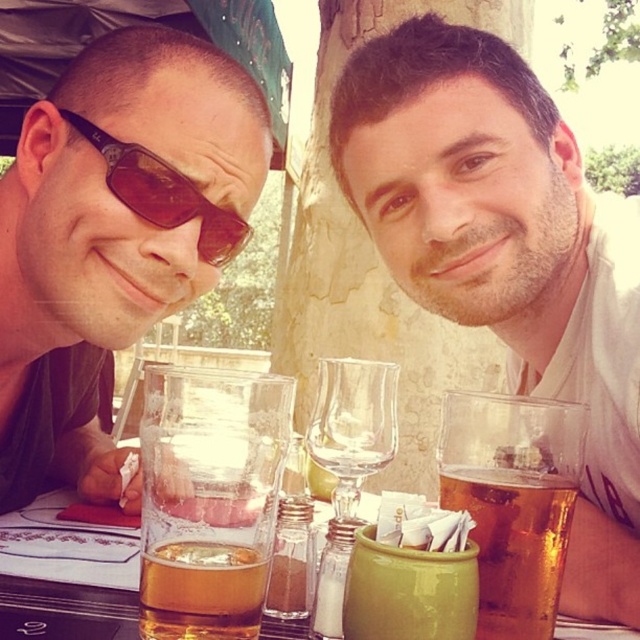
Question: Is smooth white shirt at upper right positioned at the back of translucent glass mug at center?

Choices:
 (A) yes
 (B) no

Answer: (A)

Question: Which point appears closest to the camera in this image?

Choices:
 (A) (140, 605)
 (B) (458, 90)
 (C) (259, 556)

Answer: (A)

Question: Which of the following is the farthest from the observer?

Choices:
 (A) smooth white shirt at upper right
 (B) translucent glass beer at center
 (C) brown reflective sunglasses at left
 (D) amber glass at center

Answer: (C)

Question: Is translucent glass beer at center positioned in front of translucent glass mug at center?

Choices:
 (A) yes
 (B) no

Answer: (A)

Question: Can you confirm if translucent glass beer at center is smaller than transparent glass wine glass at center?

Choices:
 (A) no
 (B) yes

Answer: (B)

Question: Which point appears closest to the camera in this image?

Choices:
 (A) (224, 628)
 (B) (60, 240)
 (C) (480, 310)
 (D) (186, 195)

Answer: (A)